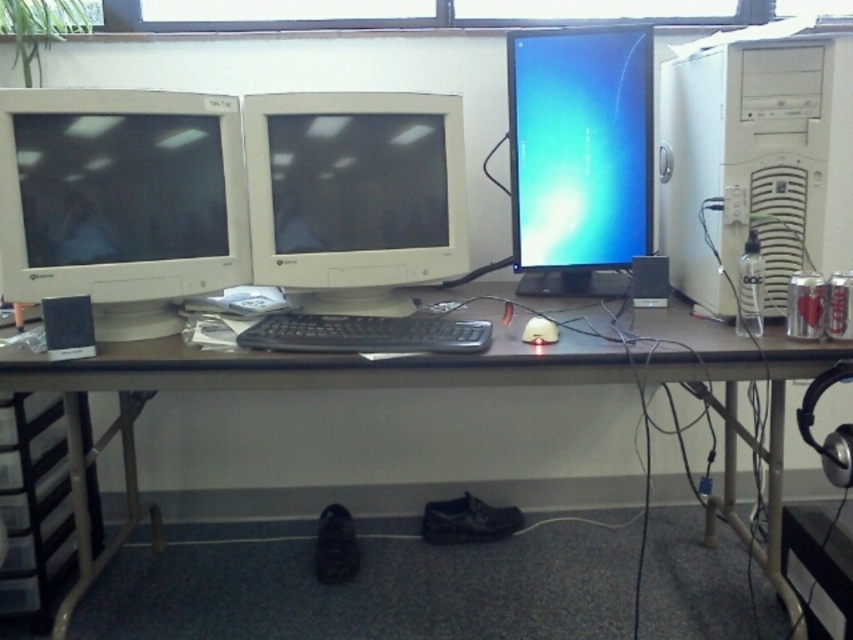
You are organizing the desk and need to place a new item at point (120, 202). Which object is already occupying that location?

The matte white monitor at left is located at point (120, 202), so that location is already occupied by the matte white monitor at left.

You are a delivery robot approaching the desk. There are two points marked on the desk. The first point is at coordinate point (22, 218) and the second point is at coordinate point (544, 336). If you need to place a package on the point that is closer to you, which coordinate point should you choose?

Point (22, 218) is in front of point (544, 336), so you should place the package on point (22, 218) since it is closer to you.

You are standing in front of the workspace and want to reach the matte white monitor at center to adjust its settings. Considering your arm length is 2.5 feet, can you comfortably reach it without moving your chair?

The matte white monitor at center is 5.80 feet away from the viewer. Since your arm length is only 2.5 feet, you cannot comfortably reach it without moving your chair.